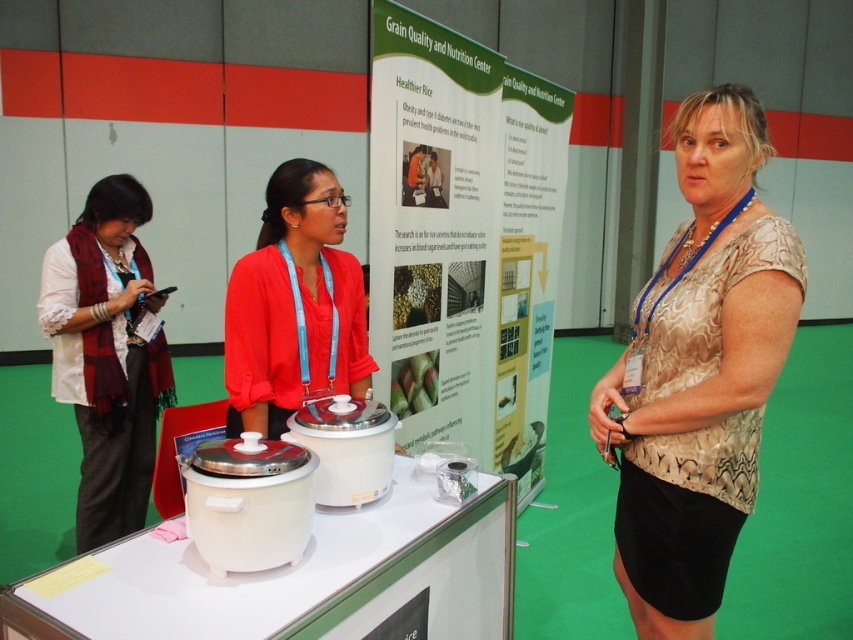
Consider the image. Is gold textured blouse at center in front of matte red blouse at center?

Yes, it is in front of matte red blouse at center.

Is gold textured blouse at center smaller than matte red blouse at center?

Incorrect, gold textured blouse at center is not smaller in size than matte red blouse at center.

Is point (711, 413) positioned in front of point (306, 301)?

Yes, point (711, 413) is in front of point (306, 301).

Where is `gold textured blouse at center`? Image resolution: width=853 pixels, height=640 pixels. gold textured blouse at center is located at coordinates (700, 372).

Is gold textured blouse at center smaller than matte white scarf at left?

Actually, gold textured blouse at center might be larger than matte white scarf at left.

Does gold textured blouse at center have a greater height compared to matte white scarf at left?

No.

Locate an element on the screen. gold textured blouse at center is located at coordinates (700, 372).

The width and height of the screenshot is (853, 640). Find the location of `gold textured blouse at center`. gold textured blouse at center is located at coordinates (700, 372).

What do you see at coordinates (463, 240) in the screenshot? I see `green paperboard poster at center` at bounding box center [463, 240].

Is green paperboard poster at center positioned in front of matte white scarf at left?

Yes, green paperboard poster at center is closer to the viewer.

Image resolution: width=853 pixels, height=640 pixels. What do you see at coordinates (463, 240) in the screenshot? I see `green paperboard poster at center` at bounding box center [463, 240].

The image size is (853, 640). Identify the location of green paperboard poster at center. (463, 240).